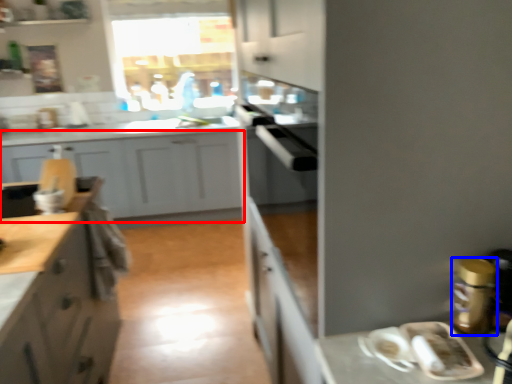
Question: Which object is further to the camera taking this photo, cabinetry (highlighted by a red box) or appliance (highlighted by a blue box)?

Choices:
 (A) cabinetry
 (B) appliance

Answer: (A)